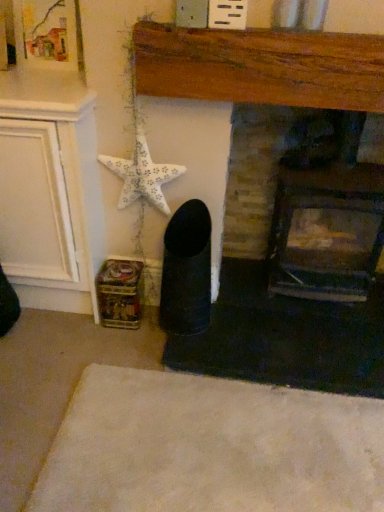
This screenshot has width=384, height=512. In order to click on free spot to the left of dark brick fireplace at center, the 2th fireplace when ordered from left to right in this screenshot , I will do `click(243, 311)`.